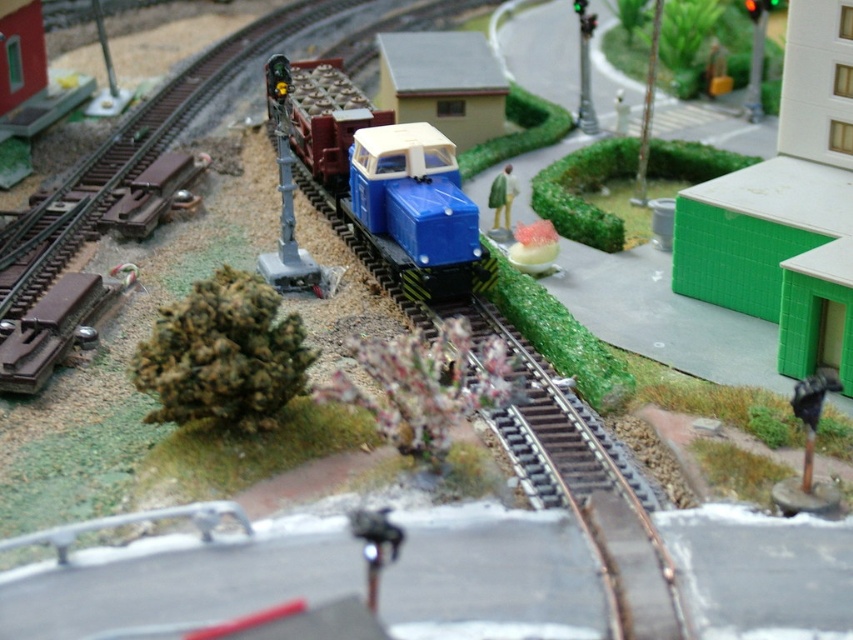
You are a model train enthusiast examining the miniature railway diorama. You notice the blue plastic train at center and the blue plastic train car at center. Which one is located to the left?

The blue plastic train at center is positioned on the left side of the blue plastic train car at center, so it is located to the left.

You are a model train enthusiast who wants to place a new miniature tree between the blue plastic train car at center and the green matte figure at center. The tree requires a minimum of 20 inches of space to fit. Based on the current setup, can the tree be placed between them?

The blue plastic train car at center is 18.99 inches from the green matte figure at center. Since the tree requires a minimum of 20 inches of space, it cannot be placed between them as the available space is insufficient.